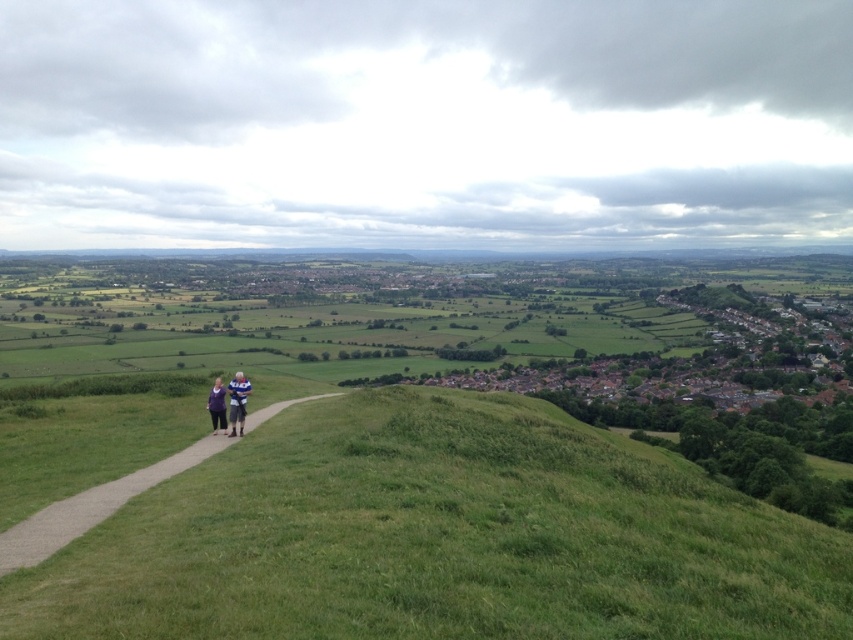
You are standing at the top of the hill looking down. You see the gravel path at center and the purple fabric at center. Which object is closer to you?

The purple fabric at center is closer to you because it is located above the gravel path at center.

You are standing at the top of the hill looking down. You see two pieces of fabric, the blue fabric shirt at center and the purple fabric at center. Which fabric is positioned more to the right side?

The blue fabric shirt at center is positioned more to the right side than the purple fabric at center.

From the picture: You are planning to walk along the gravel path at center and the purple fabric at center. Which one is longer?

The purple fabric at center is longer than the gravel path at center.